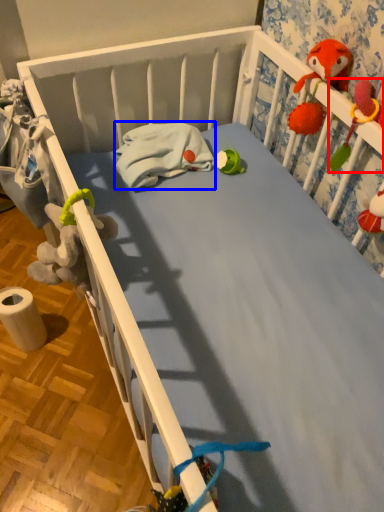
Question: Among these objects, which one is nearest to the camera, toy (highlighted by a red box) or material (highlighted by a blue box)?

Choices:
 (A) toy
 (B) material

Answer: (A)